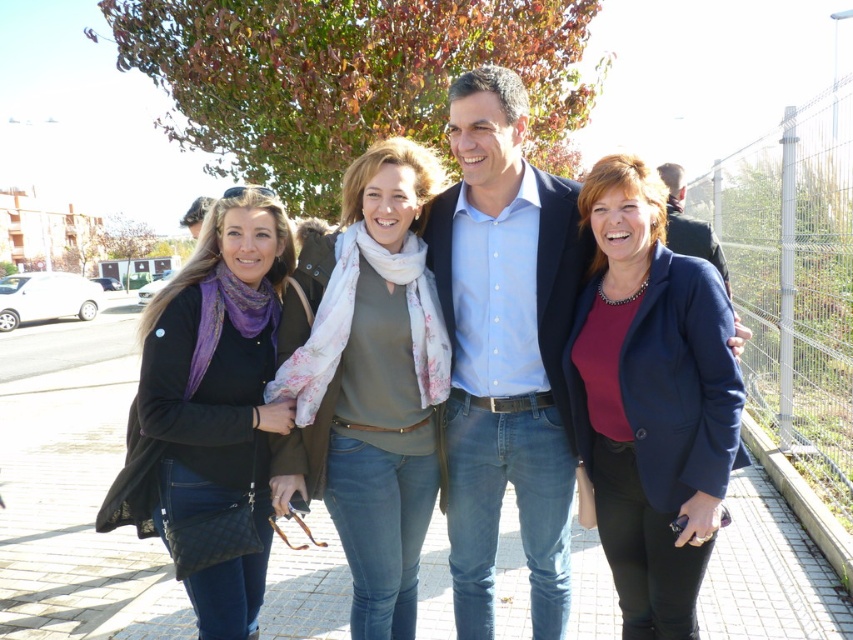
Question: Which point is farther to the camera?

Choices:
 (A) (668, 209)
 (B) (215, 451)

Answer: (A)

Question: Which object appears farthest from the camera in this image?

Choices:
 (A) floral scarf at center
 (B) blue cotton shirt at center
 (C) matte blue blazer at center
 (D) matte black jacket at center

Answer: (B)

Question: Can you confirm if black quilted jacket at left is positioned to the left of blue denim jeans at center?

Choices:
 (A) yes
 (B) no

Answer: (A)

Question: Which of the following is the closest to the observer?

Choices:
 (A) matte blue blazer at center
 (B) matte black jacket at center
 (C) floral scarf at center

Answer: (A)

Question: Considering the relative positions of matte blue blazer at center and black quilted jacket at left in the image provided, where is matte blue blazer at center located with respect to black quilted jacket at left?

Choices:
 (A) below
 (B) above

Answer: (B)

Question: Is matte black jacket at center to the right of blue denim jeans at center from the viewer's perspective?

Choices:
 (A) yes
 (B) no

Answer: (B)